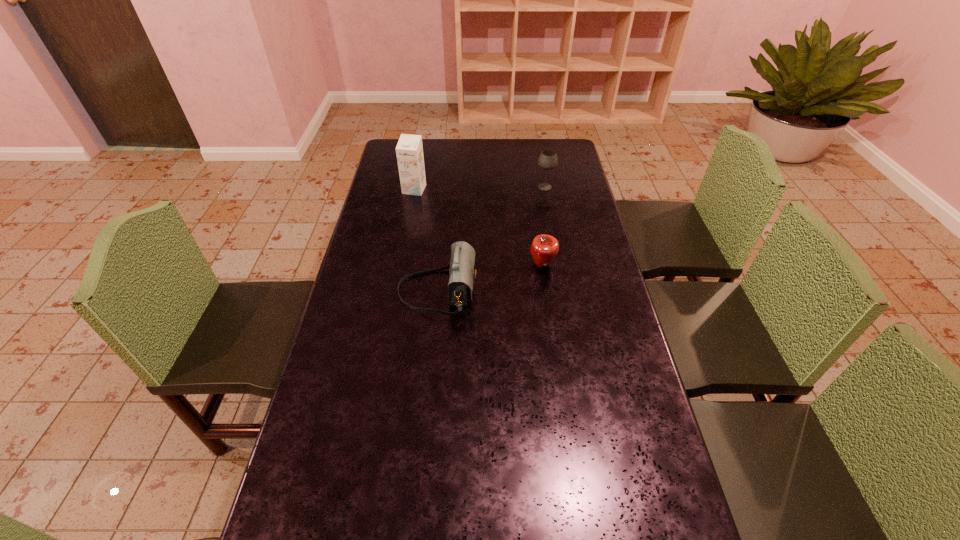
Image resolution: width=960 pixels, height=540 pixels. In order to click on object at the right edge in this screenshot , I will do `click(548, 160)`.

In the image, there is a desktop. Where is `free region at the far edge`? Image resolution: width=960 pixels, height=540 pixels. free region at the far edge is located at coordinates (535, 153).

In order to click on vacant area at the left edge of the desktop in this screenshot , I will do `click(339, 469)`.

The height and width of the screenshot is (540, 960). In the image, there is a desktop. What are the coordinates of `free space at the right edge` in the screenshot? It's located at (579, 192).

Locate an element on the screen. free space between the shoulder bag and the wineglass is located at coordinates (492, 239).

Where is `empty space that is in between the apple and the shoulder bag`? empty space that is in between the apple and the shoulder bag is located at coordinates (490, 278).

Locate an element on the screen. vacant point located between the shoulder bag and the wineglass is located at coordinates 492,239.

Find the location of a particular element. This screenshot has height=540, width=960. vacant space that's between the shoulder bag and the tallest object is located at coordinates (426, 240).

Identify the location of vacant area that lies between the shortest object and the shoulder bag. The width and height of the screenshot is (960, 540). (490, 278).

The image size is (960, 540). I want to click on vacant area that lies between the shortest object and the wineglass, so click(543, 226).